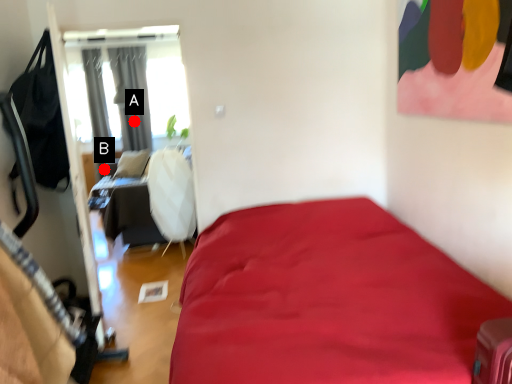
Question: Two points are circled on the image, labeled by A and B beside each circle. Which point is closer to the camera taking this photo?

Choices:
 (A) A is closer
 (B) B is closer

Answer: (B)